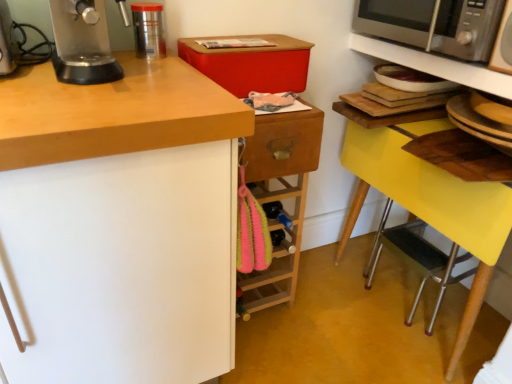
Question: Is wooden drawer at center surrounding satin silver microwave at upper right?

Choices:
 (A) yes
 (B) no

Answer: (B)

Question: From the image's perspective, does wooden drawer at center appear higher than satin silver microwave at upper right?

Choices:
 (A) no
 (B) yes

Answer: (A)

Question: From a real-world perspective, is wooden drawer at center physically above satin silver microwave at upper right?

Choices:
 (A) yes
 (B) no

Answer: (B)

Question: Considering the relative sizes of wooden drawer at center and satin silver microwave at upper right in the image provided, is wooden drawer at center wider than satin silver microwave at upper right?

Choices:
 (A) no
 (B) yes

Answer: (A)

Question: Can you confirm if wooden drawer at center is thinner than satin silver microwave at upper right?

Choices:
 (A) yes
 (B) no

Answer: (A)

Question: Does wooden drawer at center appear on the right side of satin silver microwave at upper right?

Choices:
 (A) yes
 (B) no

Answer: (B)

Question: From a real-world perspective, is wooden drawer at center below yellow plastic step stool at lower right?

Choices:
 (A) no
 (B) yes

Answer: (A)

Question: Is yellow plastic step stool at lower right inside wooden drawer at center?

Choices:
 (A) no
 (B) yes

Answer: (A)

Question: Is wooden drawer at center at the right side of yellow plastic step stool at lower right?

Choices:
 (A) yes
 (B) no

Answer: (B)

Question: Does wooden drawer at center have a greater height compared to yellow plastic step stool at lower right?

Choices:
 (A) yes
 (B) no

Answer: (A)

Question: Is yellow plastic step stool at lower right at the back of wooden drawer at center?

Choices:
 (A) yes
 (B) no

Answer: (B)

Question: From the image's perspective, is wooden drawer at center located above yellow plastic step stool at lower right?

Choices:
 (A) yes
 (B) no

Answer: (A)

Question: From the image's perspective, is satin silver microwave at upper right over satin silver microwave at upper right?

Choices:
 (A) no
 (B) yes

Answer: (A)